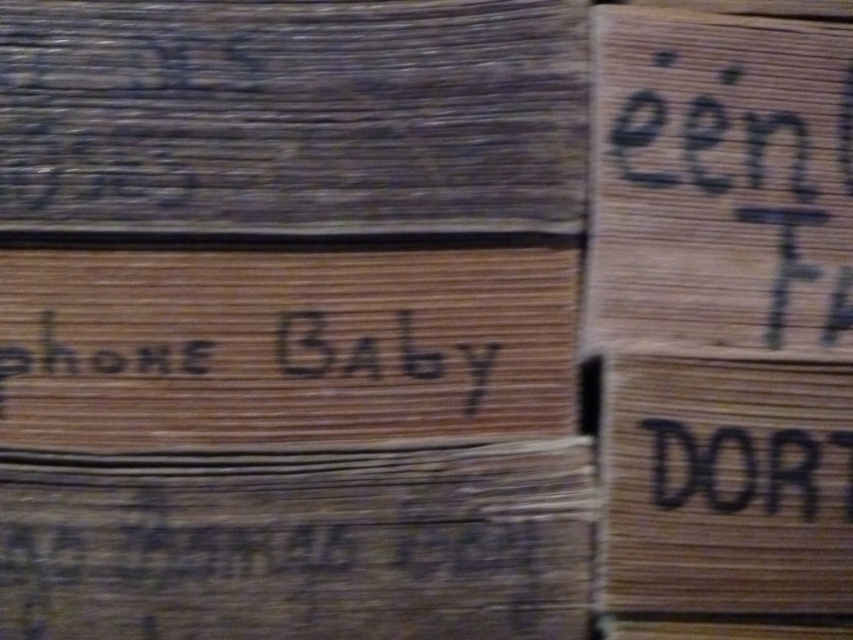
Question: Which point appears farthest from the camera in this image?

Choices:
 (A) (158, 520)
 (B) (602, 333)

Answer: (B)

Question: Among these points, which one is farthest from the camera?

Choices:
 (A) tap(184, 369)
 (B) tap(289, 321)
 (C) tap(728, 490)

Answer: (B)

Question: Is dark brown wood at upper left above wooden signboard at center?

Choices:
 (A) no
 (B) yes

Answer: (B)

Question: In this image, where is wooden sign at upper right located relative to black wood phone baby at center?

Choices:
 (A) below
 (B) above

Answer: (B)

Question: Which of the following is the closest to the observer?

Choices:
 (A) (39, 435)
 (B) (598, 342)
 (C) (724, 497)
 (D) (251, 477)

Answer: (C)

Question: Is dark brown wood at upper left bigger than black wood phone baby at center?

Choices:
 (A) yes
 (B) no

Answer: (A)